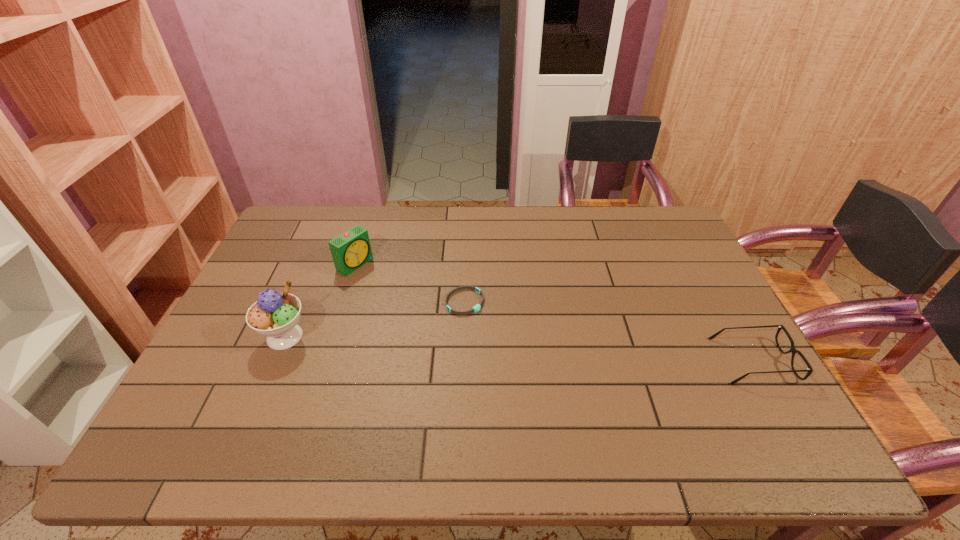
Find the location of a particular element. The width and height of the screenshot is (960, 540). free space between the wristband and the alarm clock is located at coordinates 410,283.

This screenshot has height=540, width=960. I want to click on free space between the spectacles and the wristband, so click(609, 331).

At what (x,y) coordinates should I click in order to perform the action: click on free space between the wristband and the leftmost object. Please return your answer as a coordinate pair (x, y). Looking at the image, I should click on (374, 319).

The width and height of the screenshot is (960, 540). Identify the location of free spot between the third tallest object and the leftmost object. (519, 349).

Image resolution: width=960 pixels, height=540 pixels. What are the coordinates of `empty space that is in between the icecream and the shortest object` in the screenshot? It's located at (374, 319).

Find the location of a particular element. free spot between the third object from right to left and the third object from left to right is located at coordinates (410, 283).

This screenshot has height=540, width=960. I want to click on free area in between the tallest object and the rightmost object, so click(519, 349).

The height and width of the screenshot is (540, 960). Identify the location of unoccupied position between the rightmost object and the leftmost object. (519, 349).

Where is `object that stands as the closest to the tallest object`? object that stands as the closest to the tallest object is located at coordinates (350, 250).

This screenshot has height=540, width=960. In order to click on object that is the nearest to the rightmost object in this screenshot , I will do `click(476, 308)`.